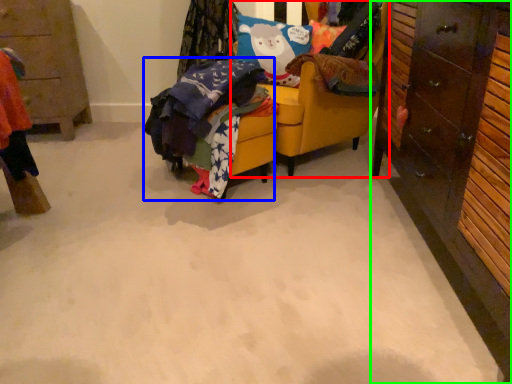
Question: Which object is positioned farthest from chair (highlighted by a red box)? Select from clothing (highlighted by a blue box) and cabinetry (highlighted by a green box).

Choices:
 (A) clothing
 (B) cabinetry

Answer: (B)